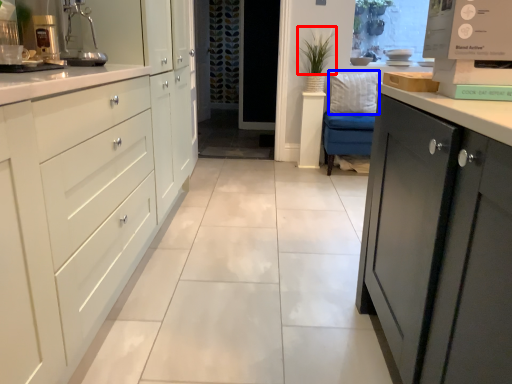
Question: Which object is closer to the camera taking this photo, plant (highlighted by a red box) or pillow (highlighted by a blue box)?

Choices:
 (A) plant
 (B) pillow

Answer: (A)